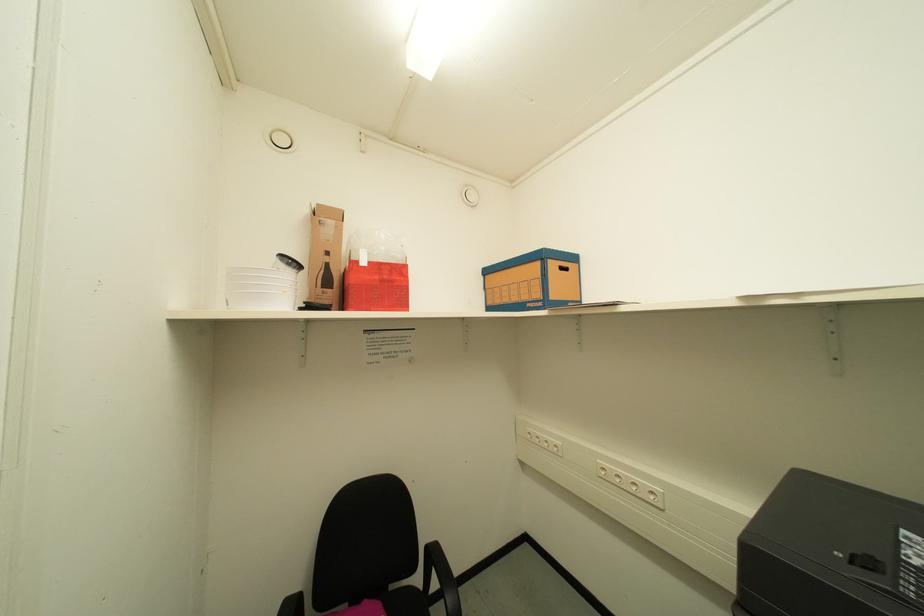
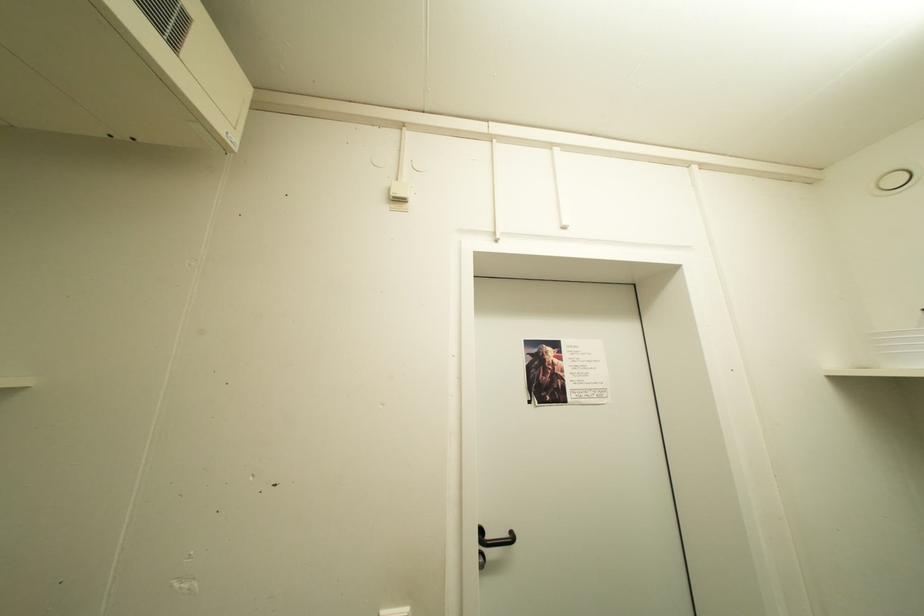
Question: The camera is either moving clockwise (left) or counter-clockwise (right) around the object. The first image is from the beginning of the video and the second image is from the end. Is the camera moving left or right when shooting the video?

Choices:
 (A) Left
 (B) Right

Answer: (B)